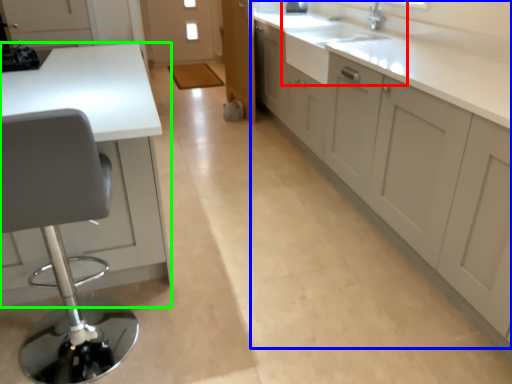
Question: Considering the real-world distances, which object is farthest from sink (highlighted by a red box)? cabinetry (highlighted by a blue box) or countertop (highlighted by a green box)?

Choices:
 (A) cabinetry
 (B) countertop

Answer: (B)